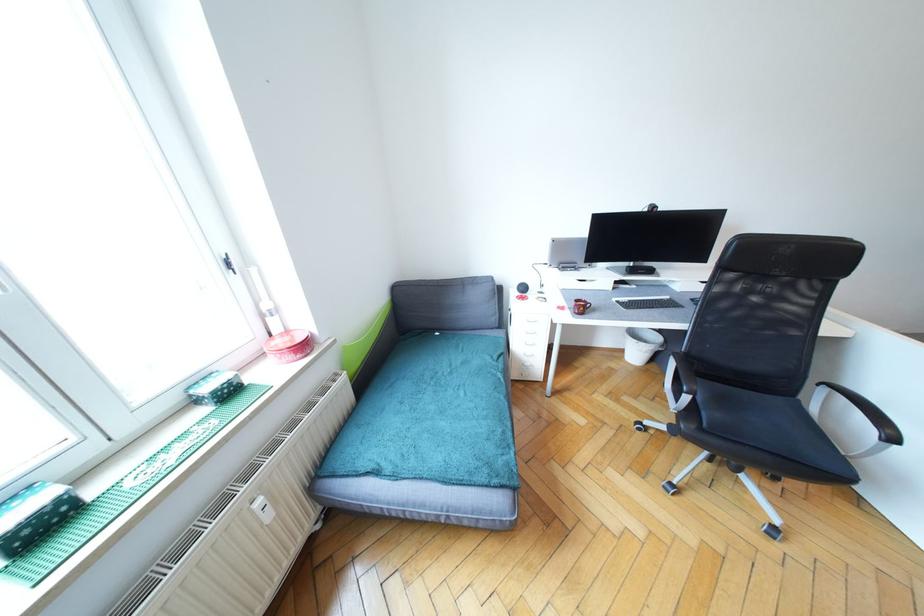
The height and width of the screenshot is (616, 924). What do you see at coordinates (579, 306) in the screenshot? I see `the brown mug handle` at bounding box center [579, 306].